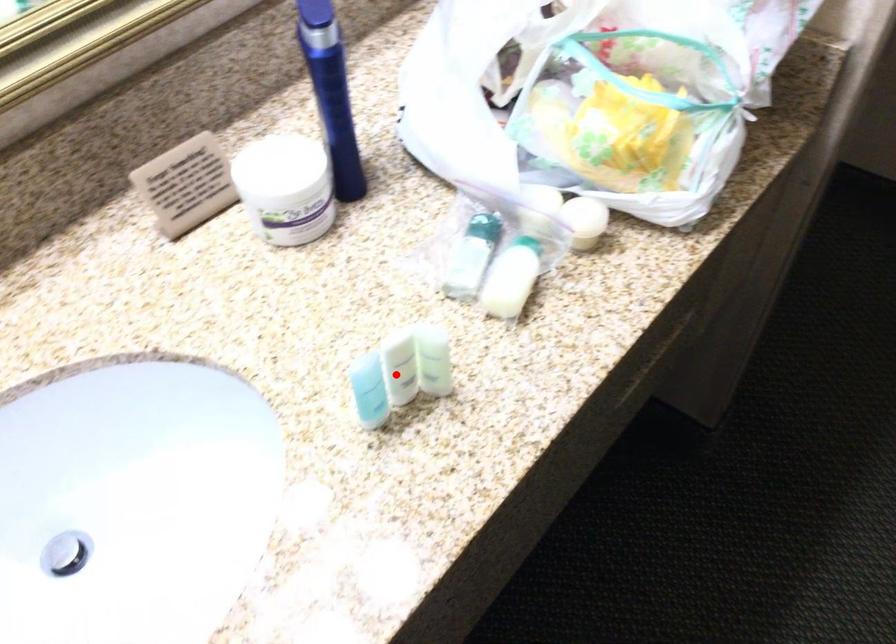
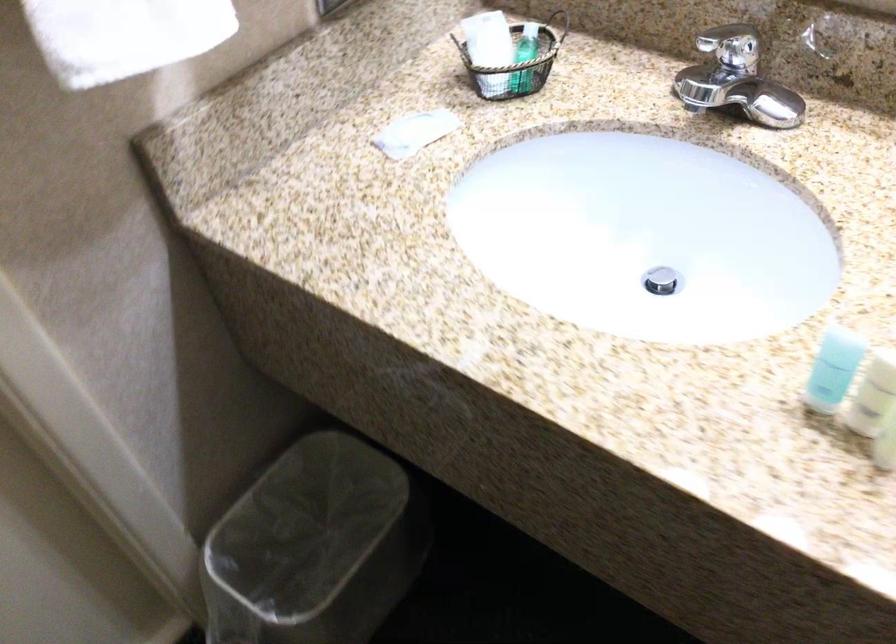
Locate, in the second image, the point that corresponds to the highlighted location in the first image.

(873, 395)